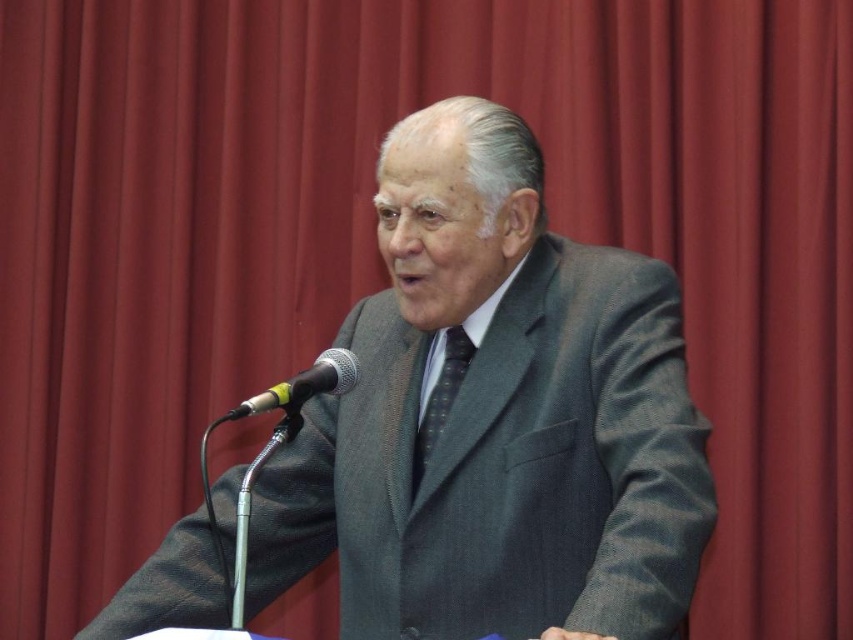
Is gray textured suit at center thinner than dark gray textured tie at center?

Incorrect, gray textured suit at center's width is not less than dark gray textured tie at center's.

Does gray textured suit at center have a lesser height compared to dark gray textured tie at center?

No, gray textured suit at center is not shorter than dark gray textured tie at center.

Image resolution: width=853 pixels, height=640 pixels. Describe the element at coordinates (496, 419) in the screenshot. I see `gray textured suit at center` at that location.

This screenshot has height=640, width=853. I want to click on gray textured suit at center, so click(x=496, y=419).

Is silver metallic microphone at center shorter than dark gray textured tie at center?

Yes, silver metallic microphone at center is shorter than dark gray textured tie at center.

Is silver metallic microphone at center to the right of dark gray textured tie at center from the viewer's perspective?

Incorrect, silver metallic microphone at center is not on the right side of dark gray textured tie at center.

The height and width of the screenshot is (640, 853). In order to click on silver metallic microphone at center in this screenshot , I will do `click(303, 385)`.

You are a GUI agent. You are given a task and a screenshot of the screen. Output one action in this format:
    pyautogui.click(x=<x>, y=<y>)
    Task: Click on the silver metallic microphone at center
    The image size is (853, 640).
    Given the screenshot: What is the action you would take?
    pyautogui.click(x=303, y=385)

How far apart are gray textured suit at center and silver metallic microphone at center?

11.32 inches

Is gray textured suit at center further to camera compared to silver metallic microphone at center?

No, gray textured suit at center is in front of silver metallic microphone at center.

Identify the location of gray textured suit at center. (496, 419).

I want to click on gray textured suit at center, so click(x=496, y=419).